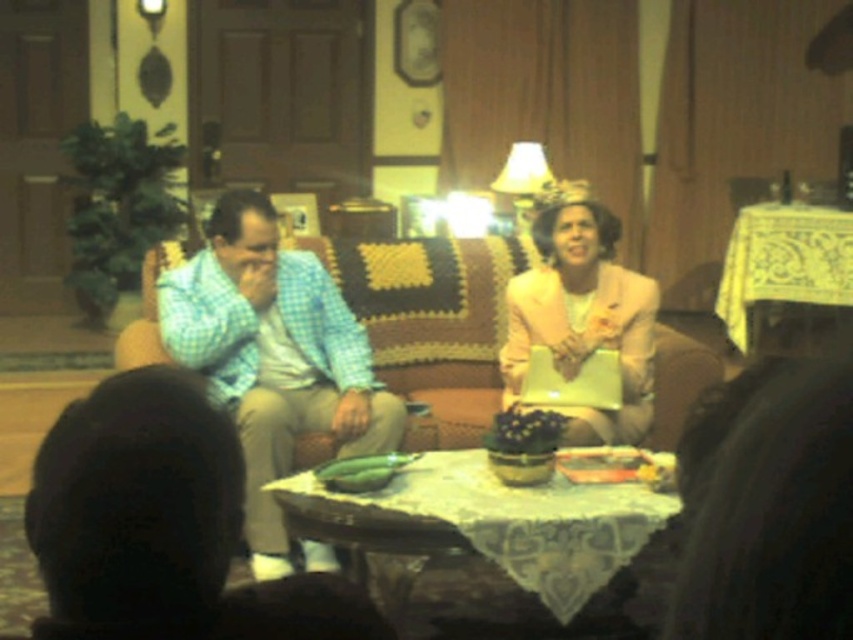
Question: Does checkered fabric shirt at center have a smaller size compared to green leafy vegetable at center?

Choices:
 (A) no
 (B) yes

Answer: (A)

Question: Can you confirm if matte pink suit at center is positioned to the left of green leafy vegetable at center?

Choices:
 (A) no
 (B) yes

Answer: (A)

Question: Estimate the real-world distances between objects in this image. Which object is closer to the matte pink suit at center?

Choices:
 (A) green fabric couch at center
 (B) yellow lace tablecloth at right
 (C) green leafy vegetable at center
 (D) checkered fabric shirt at center

Answer: (D)

Question: Does checkered fabric shirt at center appear under green leafy vegetable at center?

Choices:
 (A) no
 (B) yes

Answer: (A)

Question: Which object appears closest to the camera in this image?

Choices:
 (A) yellow lace tablecloth at right
 (B) green leafy vegetable at center

Answer: (B)

Question: Which point is closer to the camera?

Choices:
 (A) wooden tablecloth at center
 (B) yellow lace tablecloth at right

Answer: (A)